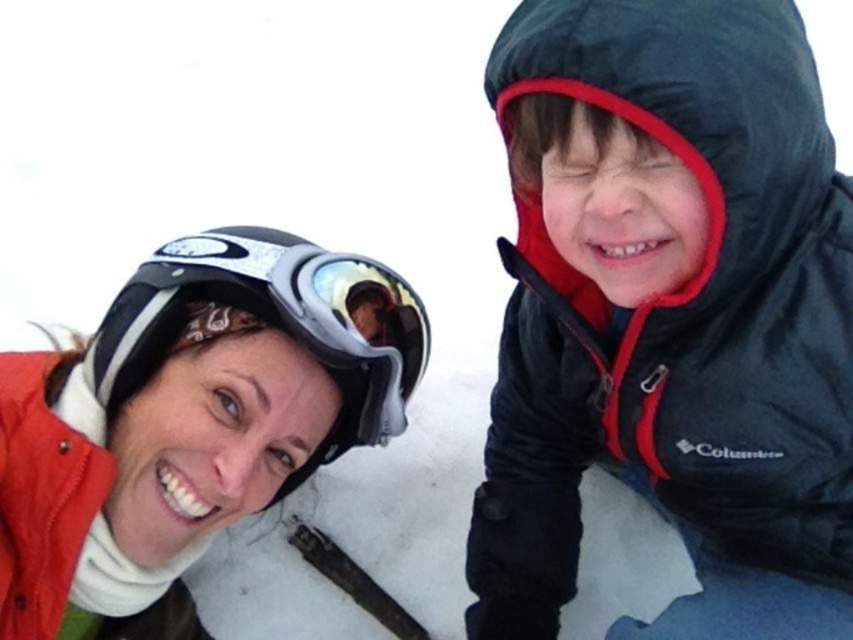
Question: Can you confirm if matte black jacket at upper right is thinner than matte black helmet at upper left?

Choices:
 (A) yes
 (B) no

Answer: (A)

Question: Is matte black jacket at upper right above matte black helmet at upper left?

Choices:
 (A) yes
 (B) no

Answer: (A)

Question: Which of the following is the closest to the observer?

Choices:
 (A) matte black helmet at upper left
 (B) matte black jacket at upper right

Answer: (B)

Question: Among these points, which one is farthest from the camera?

Choices:
 (A) (508, 106)
 (B) (274, 284)

Answer: (B)

Question: Can you confirm if matte black jacket at upper right is bigger than matte black helmet at upper left?

Choices:
 (A) no
 (B) yes

Answer: (B)